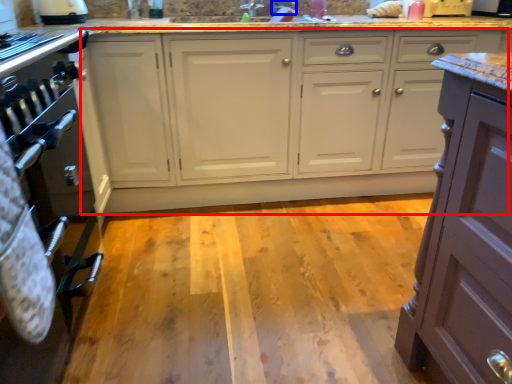
Question: Among these objects, which one is nearest to the camera, cabinetry (highlighted by a red box) or faucet (highlighted by a blue box)?

Choices:
 (A) cabinetry
 (B) faucet

Answer: (A)